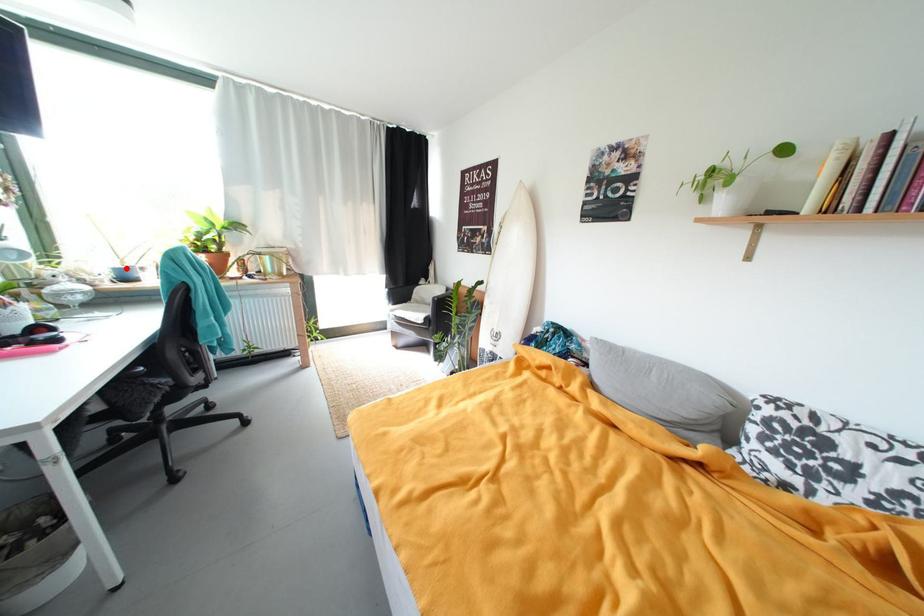
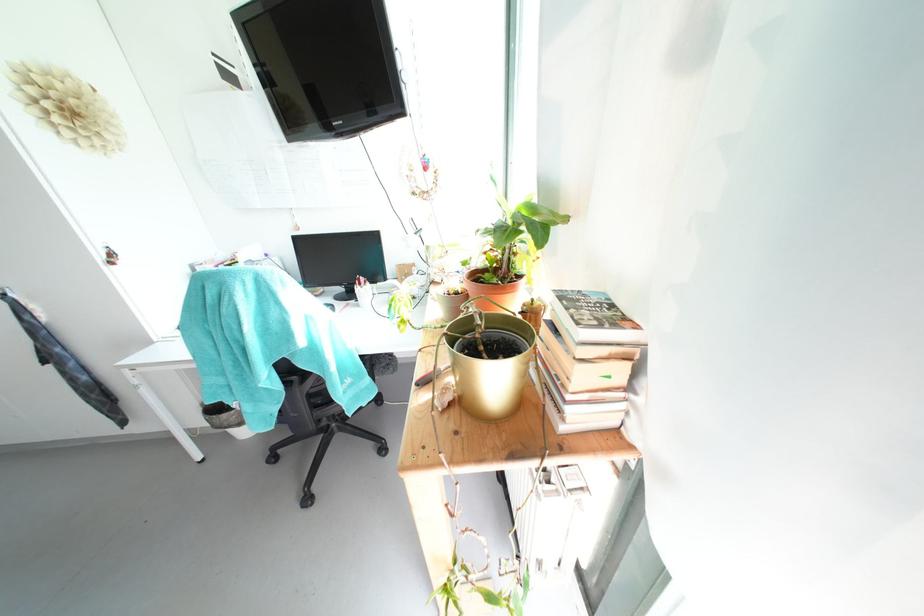
Question: I am providing you with two images of the same scene from different viewpoints. A red point is marked on the first image. Can you still see the location of the red point in image 2?

Choices:
 (A) Yes
 (B) No

Answer: (B)